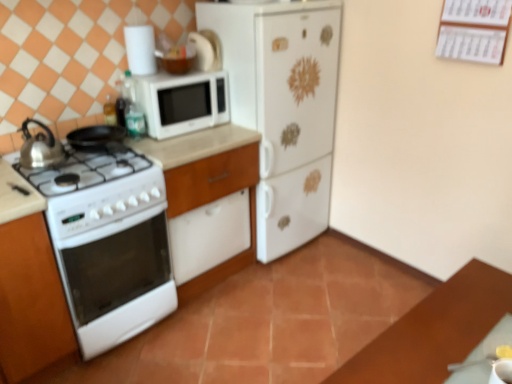
Where is `free point below shiny metallic kettle at left (from a real-world perspective)`? The image size is (512, 384). free point below shiny metallic kettle at left (from a real-world perspective) is located at coordinates (40, 153).